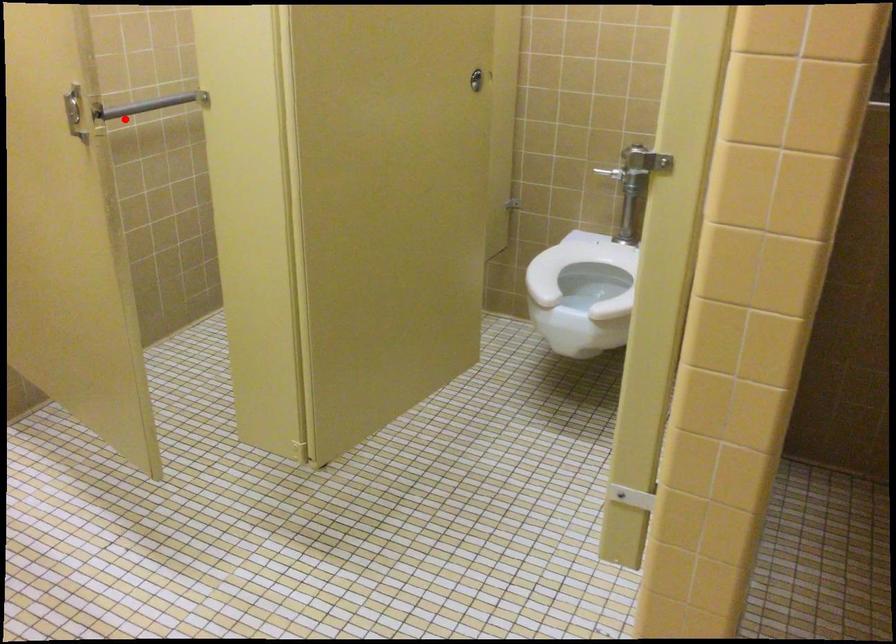
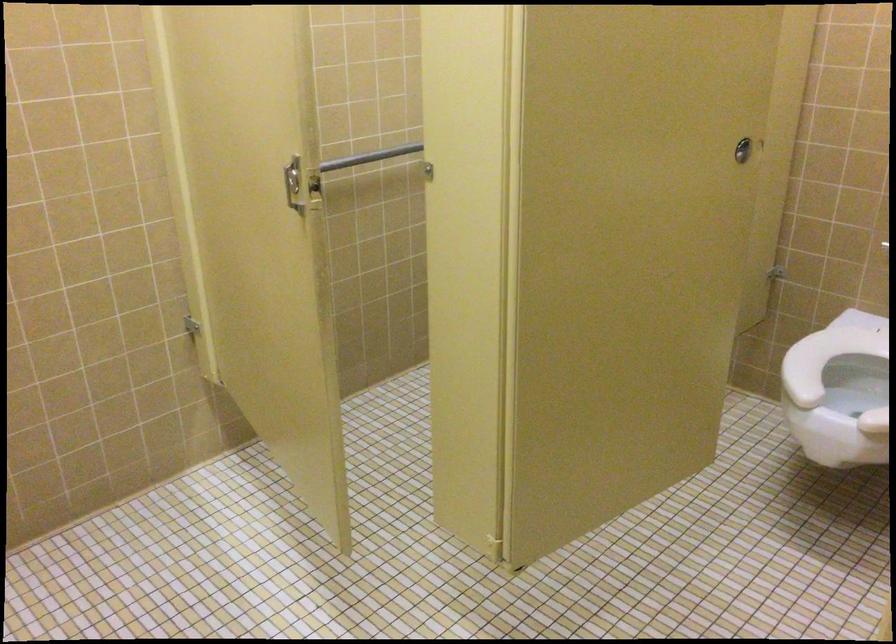
Find the pixel in the second image that matches the highlighted location in the first image.

(369, 156)